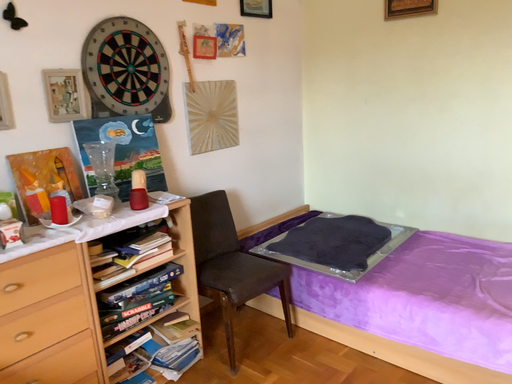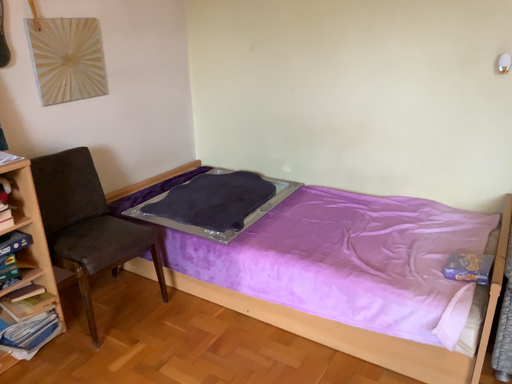
Question: How did the camera likely rotate when shooting the video?

Choices:
 (A) rotated upward
 (B) rotated downward

Answer: (B)